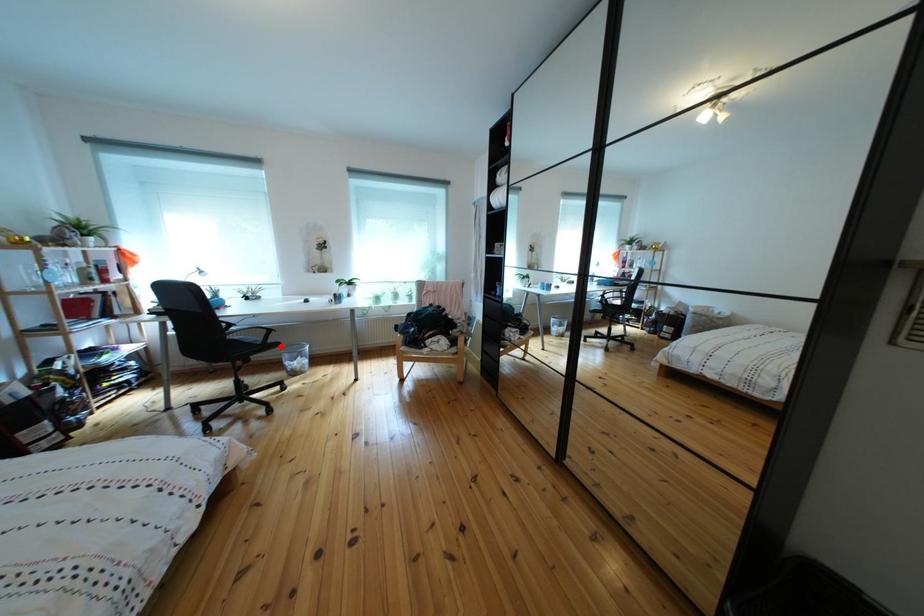
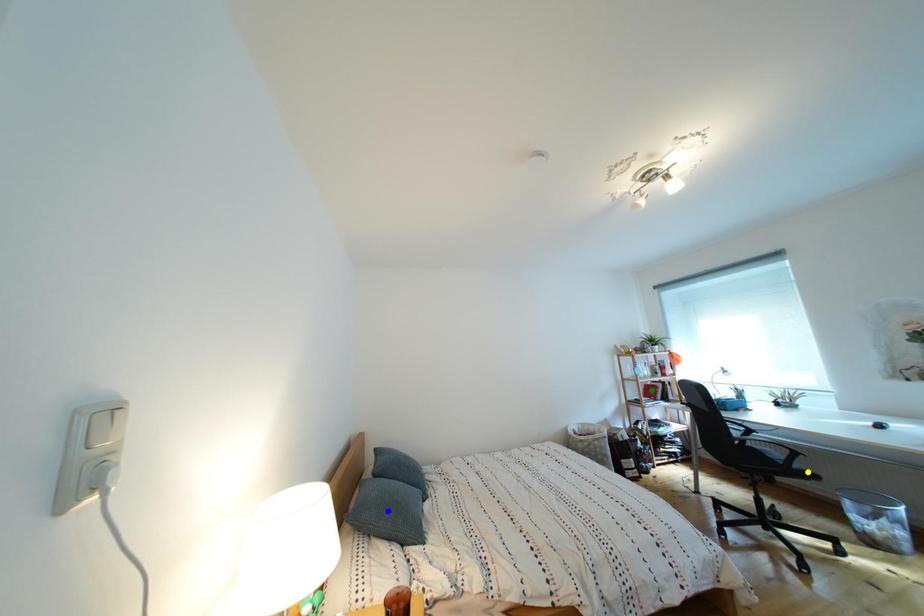
Question: I am providing you with two images of the same scene from different viewpoints. A red point is marked on the first image. You are given multiple points on the second image. Which point in image 2 is actually the same real-world point as the red point in image 1?

Choices:
 (A) blue point
 (B) yellow point
 (C) green point

Answer: (B)